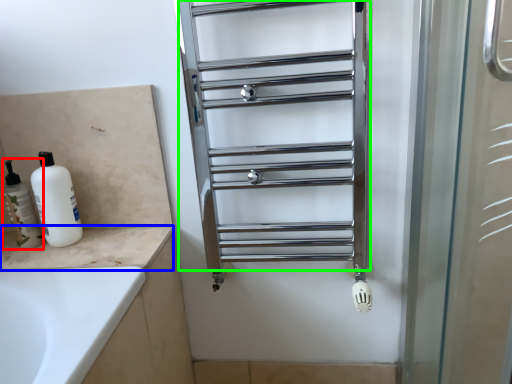
Question: Based on their relative distances, which object is nearer to toiletry (highlighted by a red box)? Choose from counter top (highlighted by a blue box) and cage (highlighted by a green box).

Choices:
 (A) counter top
 (B) cage

Answer: (A)